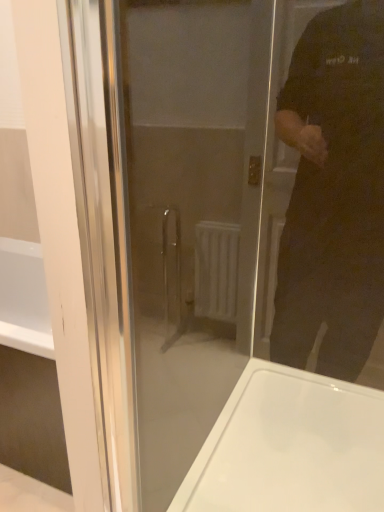
At what (x,y) coordinates should I click in order to perform the action: click on white glossy bathtub at lower right. Please return your answer as a coordinate pair (x, y). The height and width of the screenshot is (512, 384). Looking at the image, I should click on (290, 447).

Describe the element at coordinates (290, 447) in the screenshot. The height and width of the screenshot is (512, 384). I see `white glossy bathtub at lower right` at that location.

Locate an element on the screen. This screenshot has width=384, height=512. white glossy bathtub at lower right is located at coordinates (290, 447).